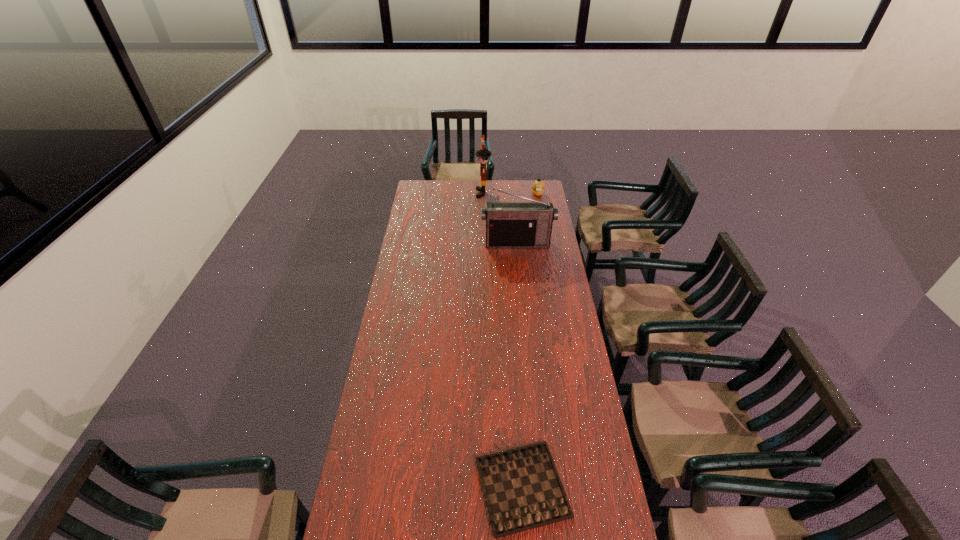
Identify the location of free space that satisfies the following two spatial constraints: 1. on the front-facing side of the chessboard; 2. on the right side of the nutcracker. Image resolution: width=960 pixels, height=540 pixels. (487, 487).

Locate an element on the screen. This screenshot has height=540, width=960. free spot that satisfies the following two spatial constraints: 1. on the back side of the chessboard; 2. on the front-facing side of the nutcracker is located at coordinates [502, 193].